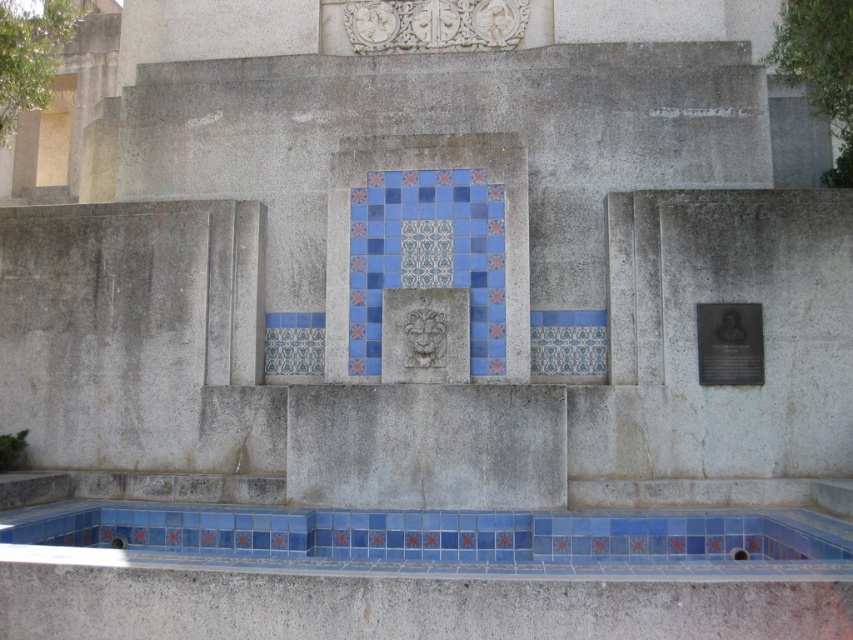
Which is more to the right, blue tile pool at lower center or black polished metal plaque at right?

Positioned to the right is black polished metal plaque at right.

Is point (393, 524) less distant than point (701, 326)?

Yes, it is in front of point (701, 326).

Locate an element on the screen. blue tile pool at lower center is located at coordinates (434, 538).